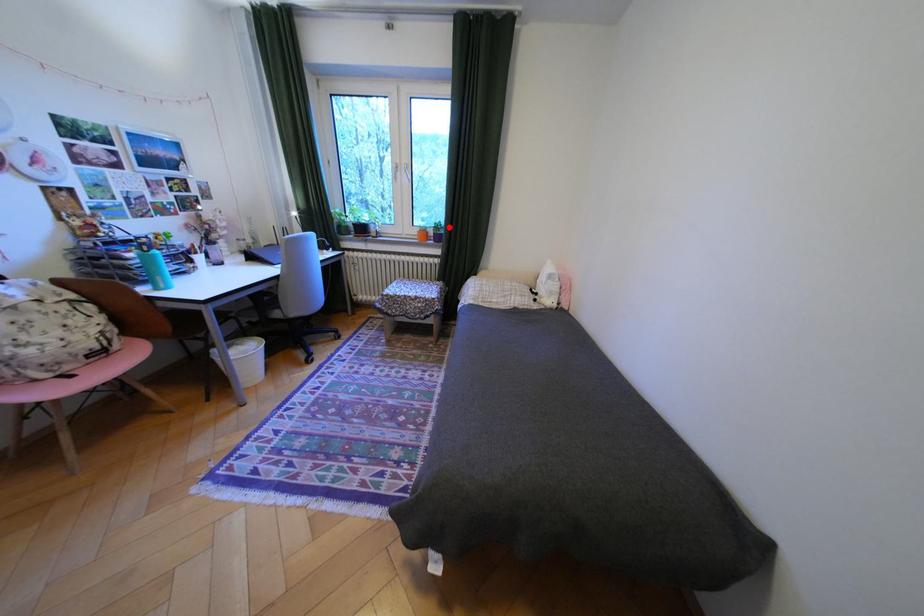
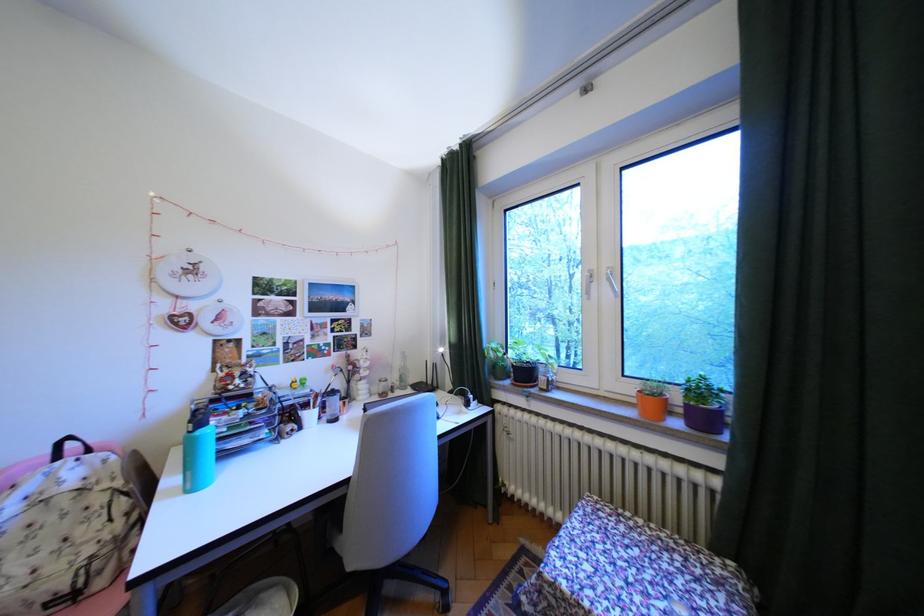
Question: I am providing you with two images of the same scene from different viewpoints. Image1 has a red point marked. In image2, the corresponding 3D location appears at what relative position? Reply with the corresponding letter.

Choices:
 (A) Closer
 (B) Farther

Answer: (B)